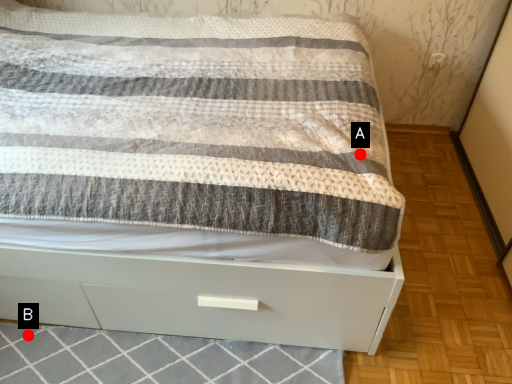
Question: Two points are circled on the image, labeled by A and B beside each circle. Among these points, which one is nearest to the camera?

Choices:
 (A) A is closer
 (B) B is closer

Answer: (A)